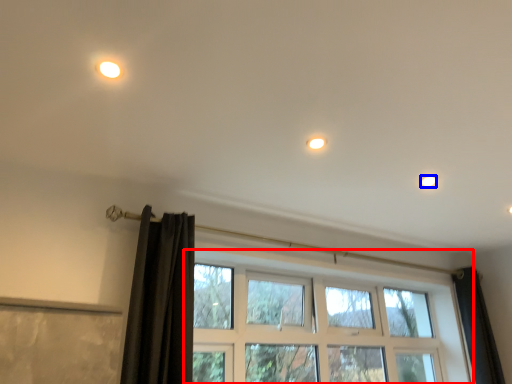
Question: Which object is further to the camera taking this photo, window (highlighted by a red box) or dot (highlighted by a blue box)?

Choices:
 (A) window
 (B) dot

Answer: (B)